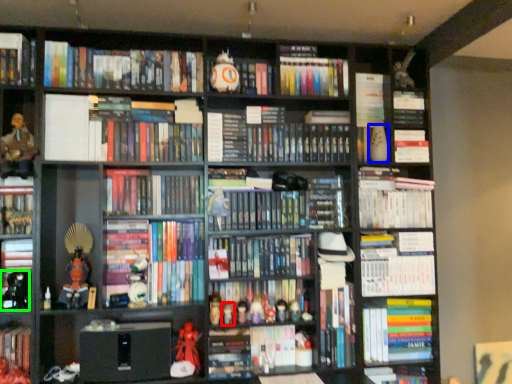
Question: Which object is positioned closest to toy (highlighted by a red box)? Select from toy (highlighted by a blue box) and toy (highlighted by a green box).

Choices:
 (A) toy
 (B) toy

Answer: (B)